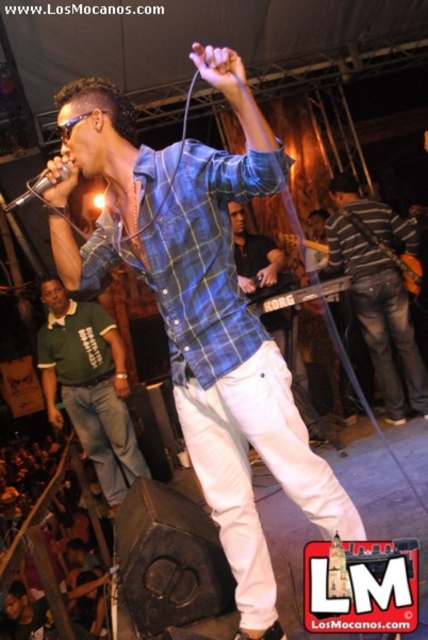
In the scene shown: Based on the scene description, can you determine the position of the striped cotton shirt at center relative to the matte black microphone at upper left?

The striped cotton shirt at center is positioned to the right of the matte black microphone at upper left.

You are a photographer at the live music performance. You want to take a photo of the blue plaid shirt at center and the wooden electric guitar at center. Which object is positioned higher in the frame?

The blue plaid shirt at center is much taller than the wooden electric guitar at center, so it is positioned higher in the frame.